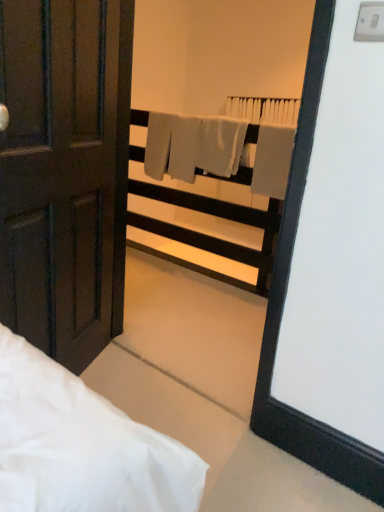
Describe the element at coordinates (65, 172) in the screenshot. I see `matte dark brown door at left` at that location.

Locate an element on the screen. matte dark brown door at left is located at coordinates (65, 172).

What's the angular difference between white plastic balustrade at upper center and gray matte towel at center's facing directions?

1.09 degrees.

Is white plastic balustrade at upper center in contact with gray matte towel at center?

They are not placed beside each other.

Is point (188, 205) behind point (273, 141)?

Yes, point (188, 205) is behind point (273, 141).

Considering the relative sizes of white plastic balustrade at upper center and gray matte towel at center in the image provided, is white plastic balustrade at upper center taller than gray matte towel at center?

Indeed, white plastic balustrade at upper center has a greater height compared to gray matte towel at center.

From the picture: Is matte dark brown door at left not close to gray matte towel at center?

That's right, there is a large distance between matte dark brown door at left and gray matte towel at center.

In the scene shown: Visually, is matte dark brown door at left positioned to the left or to the right of gray matte towel at center?

matte dark brown door at left is to the left of gray matte towel at center.

Which is more distant, (53, 89) or (253, 185)?

The point (253, 185) is behind.

From the image's perspective, is matte dark brown door at left on top of gray matte towel at center?

Incorrect, from the image's perspective, matte dark brown door at left is lower than gray matte towel at center.

What's the angular difference between white plastic balustrade at upper center and matte dark brown door at left's facing directions?

white plastic balustrade at upper center and matte dark brown door at left are facing 111 degrees away from each other.

Considering the sizes of objects white plastic balustrade at upper center and matte dark brown door at left in the image provided, who is wider, white plastic balustrade at upper center or matte dark brown door at left?

white plastic balustrade at upper center.

Can you confirm if white plastic balustrade at upper center is positioned to the right of matte dark brown door at left?

Yes, white plastic balustrade at upper center is to the right of matte dark brown door at left.

Is white plastic balustrade at upper center facing towards matte dark brown door at left?

Yes, white plastic balustrade at upper center is oriented towards matte dark brown door at left.

Image resolution: width=384 pixels, height=512 pixels. What are the coordinates of `door lying on the left of gray matte towel at center` in the screenshot? It's located at (65, 172).

Which of these two, gray matte towel at center or matte dark brown door at left, stands taller?

matte dark brown door at left is taller.

Looking at their sizes, would you say gray matte towel at center is wider or thinner than white plastic balustrade at upper center?

In the image, gray matte towel at center appears to be more narrow than white plastic balustrade at upper center.

Which is more to the left, gray matte towel at center or white plastic balustrade at upper center?

Positioned to the left is white plastic balustrade at upper center.

Based on the photo, considering the relative sizes of gray matte towel at center and white plastic balustrade at upper center in the image provided, is gray matte towel at center smaller than white plastic balustrade at upper center?

Correct, gray matte towel at center occupies less space than white plastic balustrade at upper center.

Does point (275, 186) come in front of point (264, 249)?

Yes, point (275, 186) is in front of point (264, 249).

Is matte dark brown door at left at the left side of white plastic balustrade at upper center?

Correct, you'll find matte dark brown door at left to the left of white plastic balustrade at upper center.

Which of these two, matte dark brown door at left or white plastic balustrade at upper center, is bigger?

white plastic balustrade at upper center.

Considering the relative sizes of matte dark brown door at left and white plastic balustrade at upper center in the image provided, is matte dark brown door at left taller than white plastic balustrade at upper center?

Correct, matte dark brown door at left is much taller as white plastic balustrade at upper center.

Which object is closer to the camera taking this photo, matte dark brown door at left or white plastic balustrade at upper center?

matte dark brown door at left is in front.

This screenshot has width=384, height=512. Find the location of `balustrade that appears below the gray matte towel at center (from a real-world perspective)`. balustrade that appears below the gray matte towel at center (from a real-world perspective) is located at coordinates (214, 237).

The height and width of the screenshot is (512, 384). In order to click on door in front of the gray matte towel at center in this screenshot , I will do `click(65, 172)`.

Looking at the image, which one is located closer to gray matte towel at center, white plastic balustrade at upper center or matte dark brown door at left?

white plastic balustrade at upper center.

From the image, which object appears to be farther from gray matte towel at center, matte dark brown door at left or white plastic balustrade at upper center?

Among the two, matte dark brown door at left is located further to gray matte towel at center.

Estimate the real-world distances between objects in this image. Which object is closer to white plastic balustrade at upper center, matte dark brown door at left or gray matte towel at center?

gray matte towel at center is positioned closer to the anchor white plastic balustrade at upper center.

Based on their spatial positions, is white plastic balustrade at upper center or gray matte towel at center further from matte dark brown door at left?

white plastic balustrade at upper center is positioned further to the anchor matte dark brown door at left.

Estimate the real-world distances between objects in this image. Which object is further from white plastic balustrade at upper center, gray matte towel at center or matte dark brown door at left?

matte dark brown door at left.

Considering their positions, is gray matte towel at center positioned further to matte dark brown door at left than white plastic balustrade at upper center?

white plastic balustrade at upper center lies further to matte dark brown door at left than the other object.

This screenshot has height=512, width=384. In order to click on bath towel between matte dark brown door at left and white plastic balustrade at upper center in the front-back direction in this screenshot , I will do `click(272, 160)`.